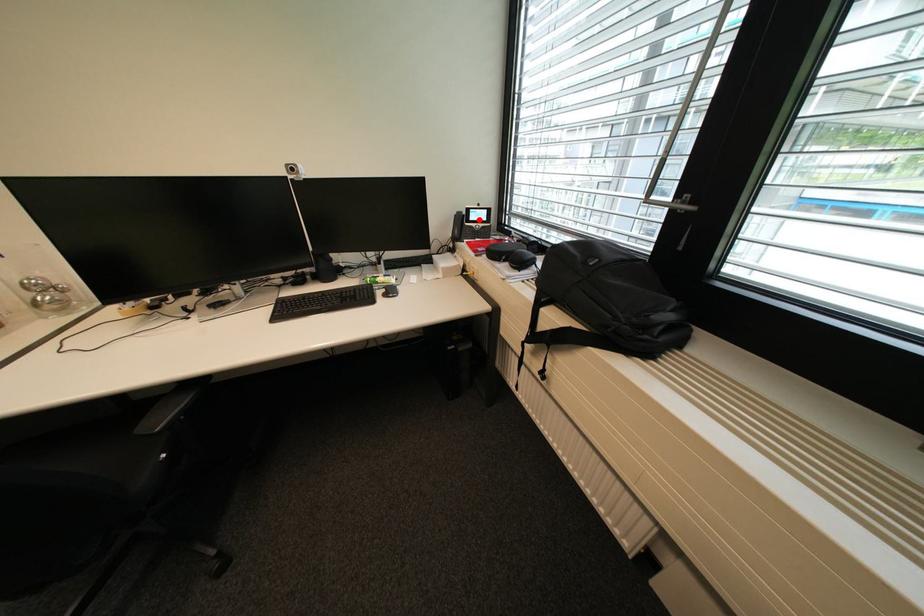
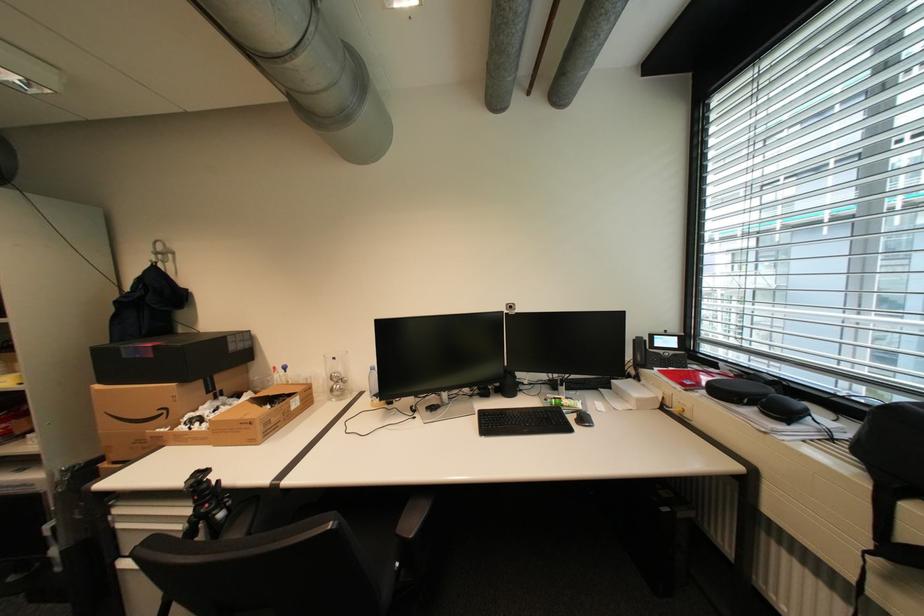
In the second image, find the point that corresponds to the highlighted location in the first image.

(664, 346)